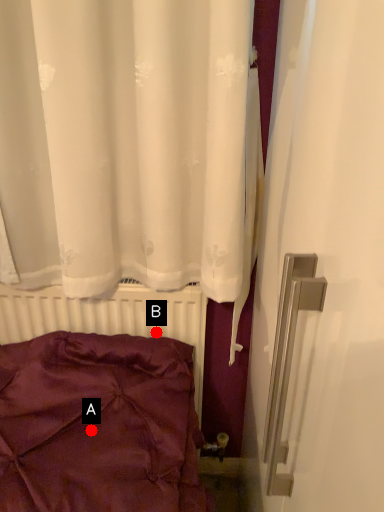
Question: Two points are circled on the image, labeled by A and B beside each circle. Which point appears closest to the camera in this image?

Choices:
 (A) A is closer
 (B) B is closer

Answer: (A)